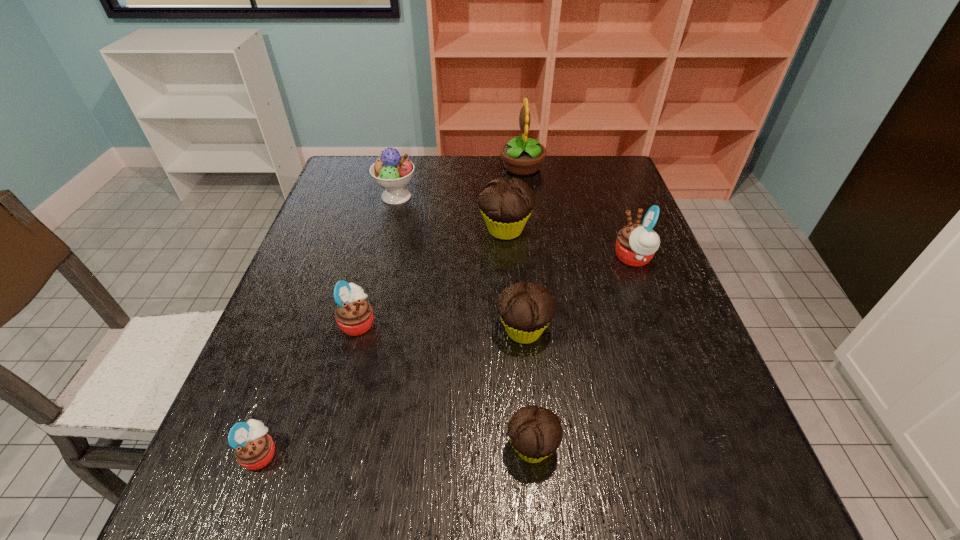
Locate an element on the screen. The image size is (960, 540). yellow sunflower is located at coordinates (522, 156).

Image resolution: width=960 pixels, height=540 pixels. I want to click on the tallest object, so click(522, 156).

Identify the location of the seventh nearest object. The width and height of the screenshot is (960, 540). (391, 172).

This screenshot has height=540, width=960. I want to click on the rightmost object, so click(x=636, y=244).

Where is `the biggest pink muffin`? the biggest pink muffin is located at coordinates (636, 244).

Identify the location of the biggest chocolate muffin. (506, 205).

The image size is (960, 540). Identify the location of the second farthest pink muffin. (354, 315).

Identify the location of the fifth muffin from right to left. The height and width of the screenshot is (540, 960). (354, 315).

At what (x,y) coordinates should I click in order to perform the action: click on the second farthest chocolate muffin. Please return your answer as a coordinate pair (x, y). The image size is (960, 540). Looking at the image, I should click on (x=526, y=310).

Locate an element on the screen. The width and height of the screenshot is (960, 540). the nearest pink muffin is located at coordinates (254, 449).